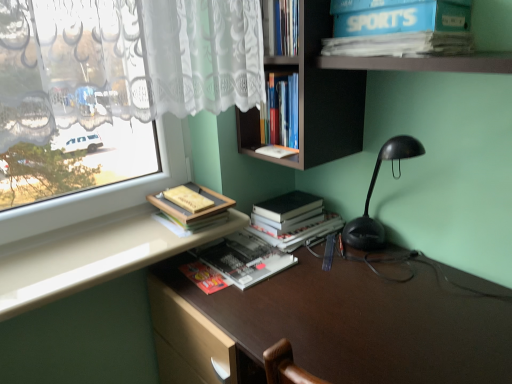
Where is `free point above hardcover black book at center, the 2th book from the bottom (from a real-world perspective)`? This screenshot has width=512, height=384. free point above hardcover black book at center, the 2th book from the bottom (from a real-world perspective) is located at coordinates (285, 204).